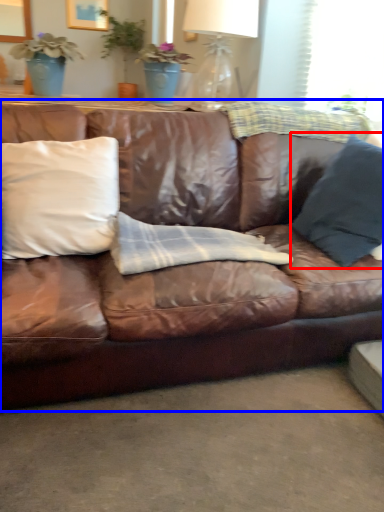
Question: Which of the following is the farthest to the observer, pillow (highlighted by a red box) or studio couch (highlighted by a blue box)?

Choices:
 (A) pillow
 (B) studio couch

Answer: (A)